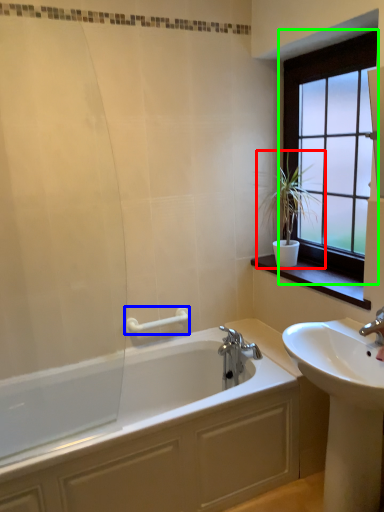
Question: Considering the real-world distances, which object is closest to houseplant (highlighted by a red box)? towel bar (highlighted by a blue box) or window (highlighted by a green box).

Choices:
 (A) towel bar
 (B) window

Answer: (B)